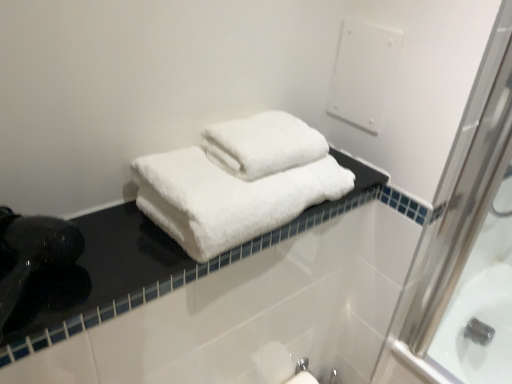
Question: Does point (129, 266) appear closer or farther from the camera than point (208, 221)?

Choices:
 (A) farther
 (B) closer

Answer: (B)

Question: Considering the positions of black glossy counter top at center and white fluffy towels at center in the image, is black glossy counter top at center taller or shorter than white fluffy towels at center?

Choices:
 (A) tall
 (B) short

Answer: (B)

Question: Considering the positions of black glossy counter top at center and white fluffy towels at center in the image, is black glossy counter top at center wider or thinner than white fluffy towels at center?

Choices:
 (A) thin
 (B) wide

Answer: (A)

Question: Is white fluffy towels at center inside the boundaries of black glossy counter top at center, or outside?

Choices:
 (A) outside
 (B) inside

Answer: (A)

Question: Relative to black glossy counter top at center, is white fluffy towels at center in front or behind?

Choices:
 (A) behind
 (B) front

Answer: (A)

Question: From a real-world perspective, is white fluffy towels at center above or below black glossy counter top at center?

Choices:
 (A) below
 (B) above

Answer: (B)

Question: In the image, is white fluffy towels at center on the left side or the right side of black glossy counter top at center?

Choices:
 (A) left
 (B) right

Answer: (B)